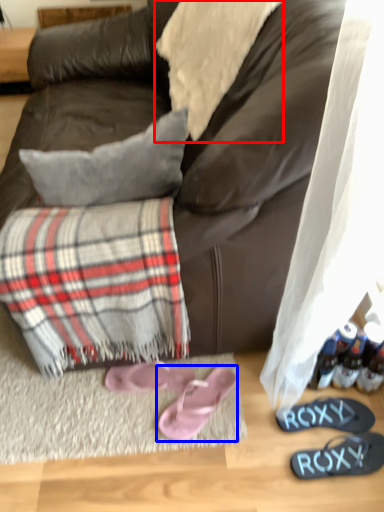
Question: Among these objects, which one is nearest to the camera, cloth (highlighted by a red box) or footwear (highlighted by a blue box)?

Choices:
 (A) cloth
 (B) footwear

Answer: (A)